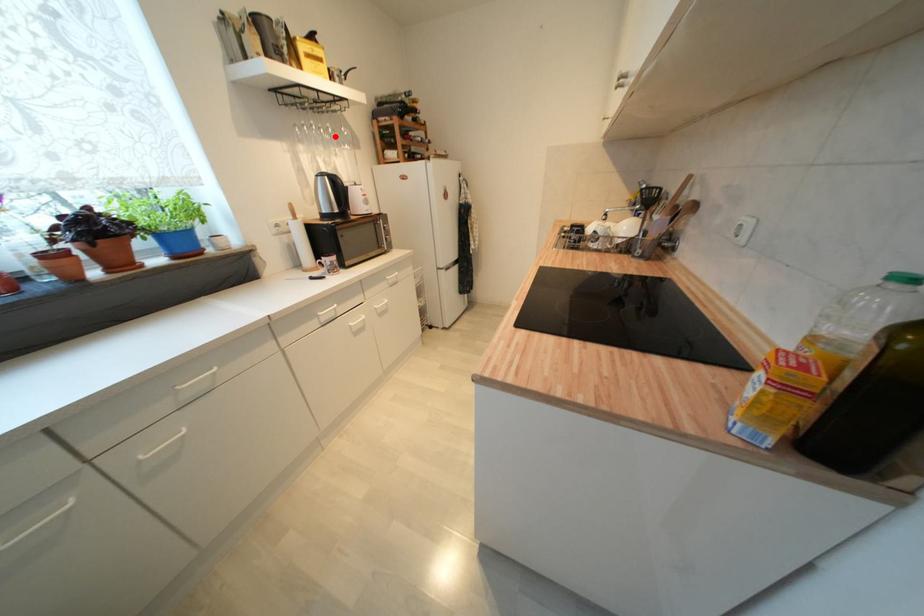
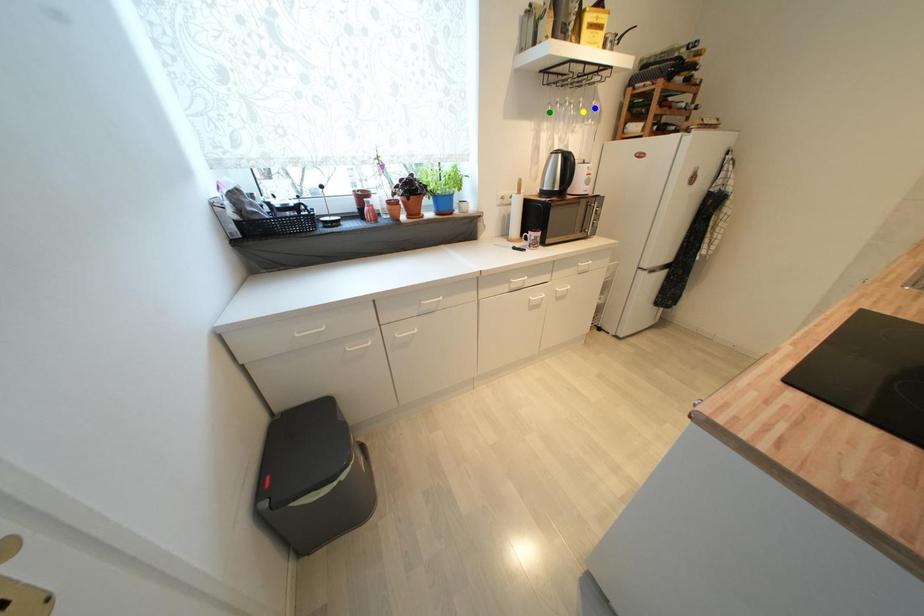
Question: I am providing you with two images of the same scene from different viewpoints. A red point is marked on the first image. You are given multiple points on the second image. Which mark in image 2 goes with the point in image 1?

Choices:
 (A) blue point
 (B) green point
 (C) yellow point

Answer: (C)